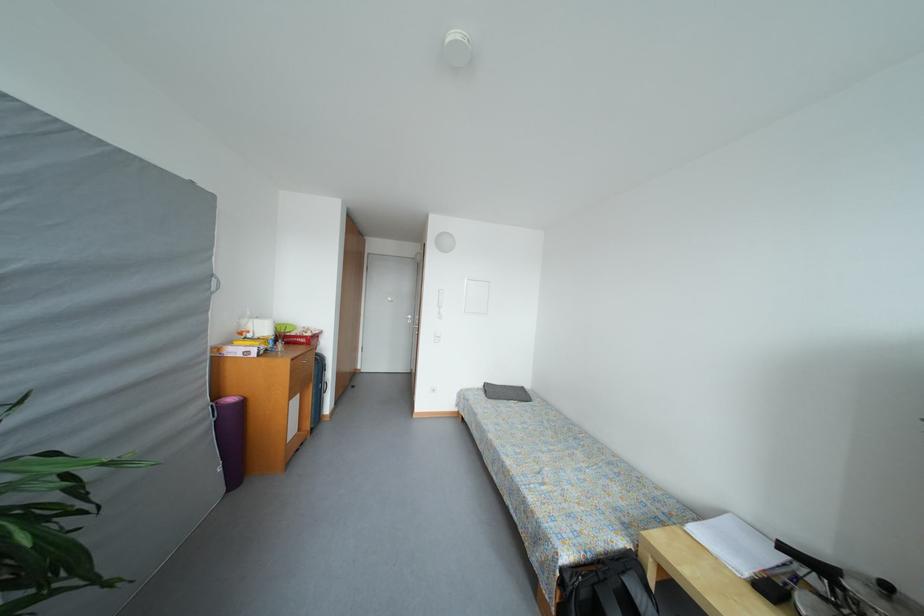
At what (x,y) coordinates should I click in order to perform the action: click on white light switch. Please return your answer as a coordinate pair (x, y). This screenshot has width=924, height=616. Looking at the image, I should click on (476, 296).